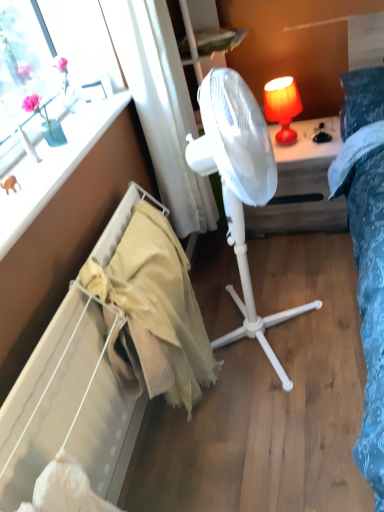
What do you see at coordinates (53, 167) in the screenshot? The image size is (384, 512). I see `matte white window sill at upper left` at bounding box center [53, 167].

The height and width of the screenshot is (512, 384). I want to click on beige fabric radiator at lower left, so click(x=48, y=395).

What do you see at coordinates (239, 186) in the screenshot? This screenshot has width=384, height=512. I see `white plastic fan at center` at bounding box center [239, 186].

Where is `beige cotton blanket at lower left`? The image size is (384, 512). beige cotton blanket at lower left is located at coordinates (159, 298).

At what (x,y) coordinates should I click in order to perform the action: click on matte white window sill at upper left. Please return your answer as a coordinate pair (x, y). The image size is (384, 512). Looking at the image, I should click on (53, 167).

How distant is beige fabric radiator at lower left from white plastic fan at center?

beige fabric radiator at lower left is 3.54 feet away from white plastic fan at center.

Considering the relative sizes of beige fabric radiator at lower left and white plastic fan at center in the image provided, is beige fabric radiator at lower left taller than white plastic fan at center?

Correct, beige fabric radiator at lower left is much taller as white plastic fan at center.

This screenshot has width=384, height=512. Find the location of `desk lying on the right of beige fabric radiator at lower left`. desk lying on the right of beige fabric radiator at lower left is located at coordinates (301, 185).

Who is bigger, beige fabric radiator at lower left or white plastic fan at center?

white plastic fan at center.

Based on the photo, how different are the orientations of matte orange lampshade at upper right and white plastic fan at center in degrees?

matte orange lampshade at upper right and white plastic fan at center are facing 0.909 degrees away from each other.

Is there a large distance between matte orange lampshade at upper right and white plastic fan at center?

They are positioned close to each other.

Which of these two, matte orange lampshade at upper right or white plastic fan at center, stands shorter?

With less height is matte orange lampshade at upper right.

Find the location of `desk on the right of matte orange lampshade at upper right`. desk on the right of matte orange lampshade at upper right is located at coordinates (301, 185).

Based on the photo, is beige fabric radiator at lower left to the left of white sheer curtain at upper center from the viewer's perspective?

Yes.

From a real-world perspective, is beige fabric radiator at lower left positioned above or below white sheer curtain at upper center?

Clearly, from a real-world perspective, beige fabric radiator at lower left is below white sheer curtain at upper center.

Which is farther, (129, 398) or (115, 39)?

Positioned behind is point (115, 39).

Would you say beige fabric radiator at lower left is inside or outside white sheer curtain at upper center?

The correct answer is: outside.

Is beige fabric radiator at lower left turned away from matte orange lampshade at upper right?

beige fabric radiator at lower left is not turned away from matte orange lampshade at upper right.

Considering the relative positions of beige fabric radiator at lower left and matte orange lampshade at upper right in the image provided, is beige fabric radiator at lower left behind matte orange lampshade at upper right?

No, it is not.

How different are the orientations of beige fabric radiator at lower left and matte orange lampshade at upper right in degrees?

89.4 degrees separate the facing orientations of beige fabric radiator at lower left and matte orange lampshade at upper right.

Is point (35, 385) positioned in front of point (281, 123)?

Yes, point (35, 385) is in front of point (281, 123).

Which of these two, beige cotton blanket at lower left or beige fabric radiator at lower left, stands shorter?

With less height is beige fabric radiator at lower left.

Is point (157, 280) farther from camera compared to point (65, 421)?

Yes, point (157, 280) is behind point (65, 421).

How much distance is there between beige cotton blanket at lower left and beige fabric radiator at lower left?

beige cotton blanket at lower left and beige fabric radiator at lower left are 7.81 inches apart from each other.

Does beige cotton blanket at lower left lie in front of beige fabric radiator at lower left?

That is False.

From a real-world perspective, which object rests below the other?

In real-world perspective, beige cotton blanket at lower left is lower.

Considering the relative sizes of white plastic fan at center and beige cotton blanket at lower left in the image provided, is white plastic fan at center wider than beige cotton blanket at lower left?

Yes, white plastic fan at center is wider than beige cotton blanket at lower left.

Is white plastic fan at center smaller than beige cotton blanket at lower left?

No.

How much distance is there between white plastic fan at center and beige cotton blanket at lower left?

The distance of white plastic fan at center from beige cotton blanket at lower left is 17.04 inches.

Is point (137, 213) farther from camera compared to point (299, 187)?

No.

Is beige cotton blanket at lower left touching white plastic fan at center?

No, beige cotton blanket at lower left is not making contact with white plastic fan at center.

From a real-world perspective, relative to white plastic fan at center, is beige cotton blanket at lower left vertically above or below?

beige cotton blanket at lower left is above white plastic fan at center.

Is beige cotton blanket at lower left positioned before white plastic fan at center?

Yes, beige cotton blanket at lower left is in front of white plastic fan at center.

The width and height of the screenshot is (384, 512). Identify the location of radiator in front of the white plastic fan at center. (48, 395).

Find the location of a particular element. The image size is (384, 512). desk that is below the matte orange lampshade at upper right (from the image's perspective) is located at coordinates (301, 185).

Looking at the image, which one is located further to white sheer curtain at upper center, beige fabric radiator at lower left or white plastic fan at center?

beige fabric radiator at lower left is positioned further to the anchor white sheer curtain at upper center.

Estimate the real-world distances between objects in this image. Which object is further from white plastic fan at center, white sheer curtain at upper center or matte orange lampshade at upper right?

Among the two, white sheer curtain at upper center is located further to white plastic fan at center.

Based on their spatial positions, is white plastic fan at center or white plastic fan at center further from beige cotton blanket at lower left?

The object further to beige cotton blanket at lower left is white plastic fan at center.

Looking at the image, which one is located further to white plastic fan at center, matte orange lampshade at upper right or beige cotton blanket at lower left?

The object further to white plastic fan at center is matte orange lampshade at upper right.

Based on their spatial positions, is white plastic fan at center or white plastic fan at center closer to matte orange lampshade at upper right?

white plastic fan at center is closer to matte orange lampshade at upper right.

Estimate the real-world distances between objects in this image. Which object is further from matte orange lampshade at upper right, beige cotton blanket at lower left or white plastic fan at center?

beige cotton blanket at lower left lies further to matte orange lampshade at upper right than the other object.

Considering their positions, is white plastic fan at center positioned closer to matte orange lampshade at upper right than white sheer curtain at upper center?

white sheer curtain at upper center is closer to matte orange lampshade at upper right.

From the image, which object appears to be nearer to white sheer curtain at upper center, beige cotton blanket at lower left or white plastic fan at center?

white plastic fan at center is positioned closer to the anchor white sheer curtain at upper center.

Identify the location of blanket located between matte white window sill at upper left and white plastic fan at center in the left-right direction. The height and width of the screenshot is (512, 384). (159, 298).

Locate an element on the screen. This screenshot has height=512, width=384. lamp located between white sheer curtain at upper center and white plastic fan at center in the depth direction is located at coordinates (282, 106).

You are a GUI agent. You are given a task and a screenshot of the screen. Output one action in this format:
    pyautogui.click(x=<x>, y=<y>)
    Task: Click on the mechanical fan located between beige fabric radiator at lower left and matte orange lampshade at upper right in the depth direction
    
    Given the screenshot: What is the action you would take?
    pyautogui.click(x=239, y=186)

In order to click on window sill between beige fabric radiator at lower left and white plastic fan at center along the z-axis in this screenshot , I will do `click(53, 167)`.